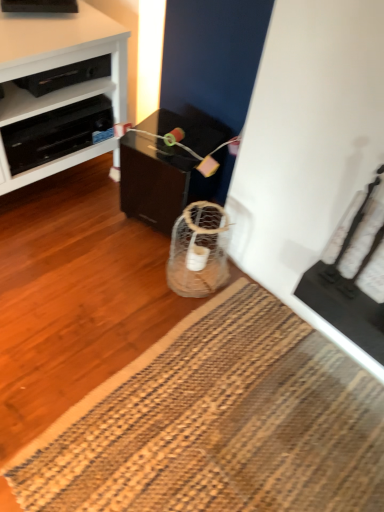
The width and height of the screenshot is (384, 512). What are the coordinates of `free spot above white glossy cabinet at left (from a real-world perspective)` in the screenshot? It's located at (38, 28).